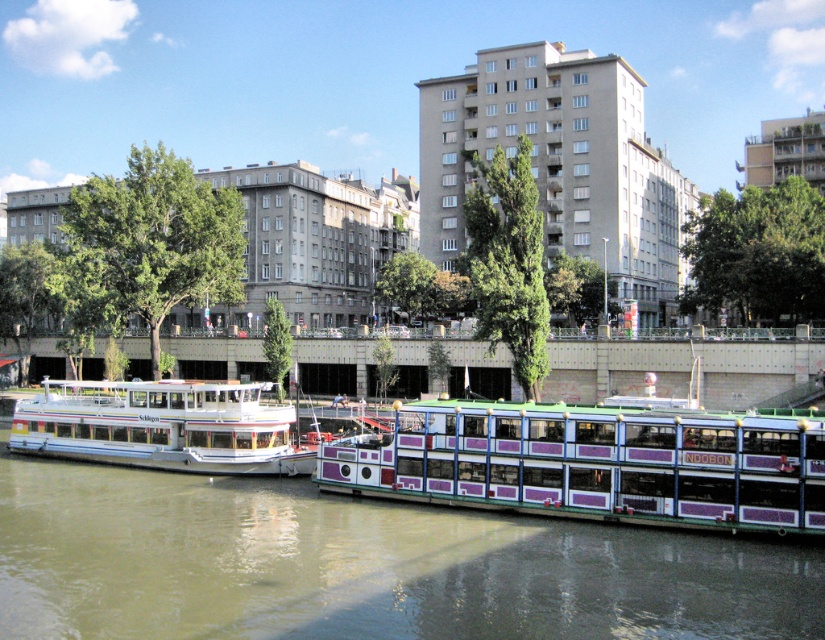
Question: Does greenish-brown water at center have a greater width compared to white glossy boat at left?

Choices:
 (A) yes
 (B) no

Answer: (A)

Question: Which is nearer to the white glossy boat at left?

Choices:
 (A) purple painted glass boat at center
 (B) greenish-brown water at center

Answer: (B)

Question: Which of the following is the farthest from the observer?

Choices:
 (A) (192, 608)
 (B) (135, 452)
 (C) (757, 513)

Answer: (B)

Question: Is greenish-brown water at center thinner than white glossy boat at left?

Choices:
 (A) no
 (B) yes

Answer: (A)

Question: Which is farther from the greenish-brown water at center?

Choices:
 (A) purple painted glass boat at center
 (B) white glossy boat at left

Answer: (B)

Question: Is purple painted glass boat at center thinner than white glossy boat at left?

Choices:
 (A) no
 (B) yes

Answer: (A)